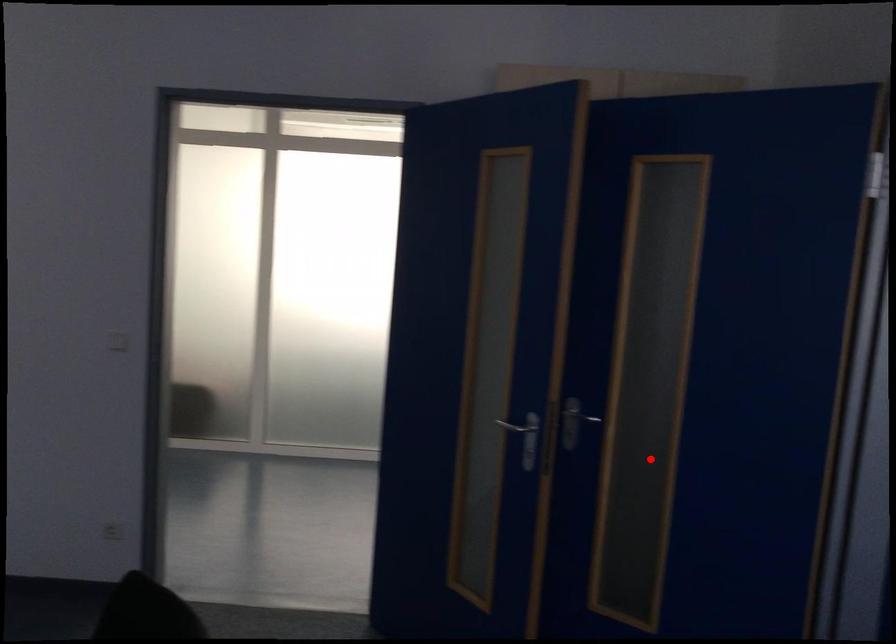
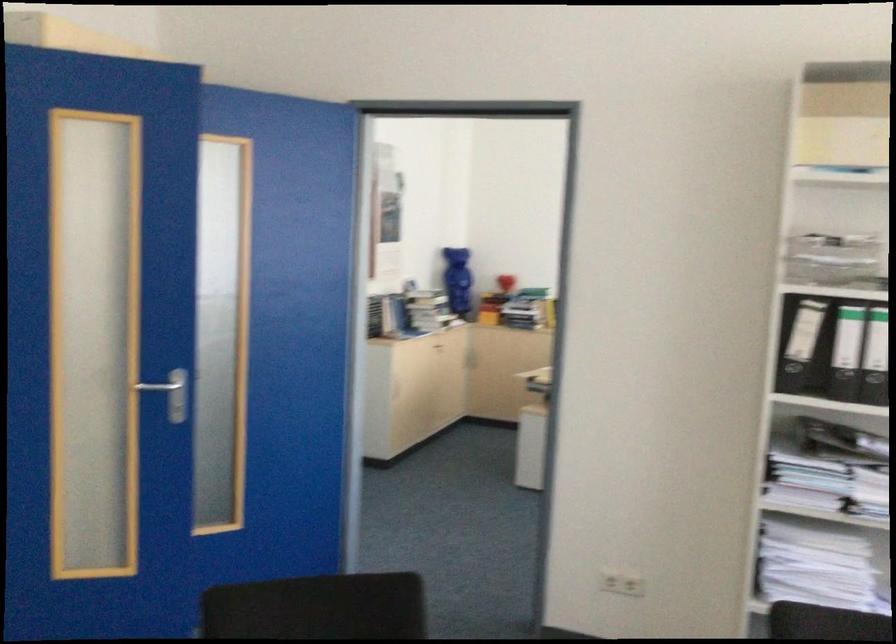
Locate, in the second image, the point that corresponds to the highlighted location in the first image.

(176, 398)